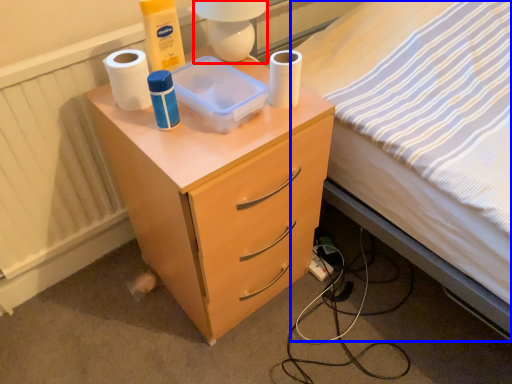
Question: Which point is further to the camera, lamp (highlighted by a red box) or bed (highlighted by a blue box)?

Choices:
 (A) lamp
 (B) bed

Answer: (A)